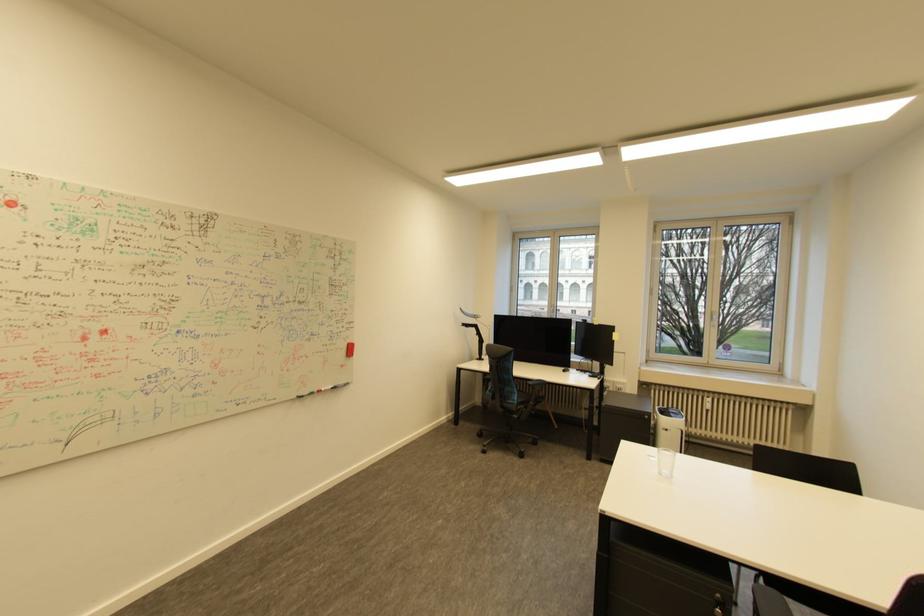
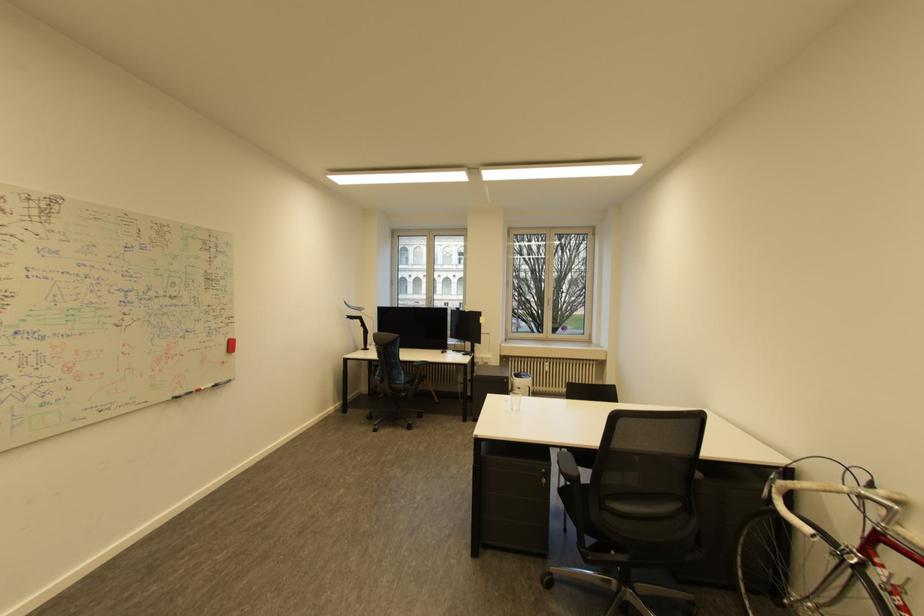
Question: Based on the continuous images, in which direction is the camera rotating? Reply with the corresponding letter.

Choices:
 (A) Left
 (B) Right
 (C) Up
 (D) Down

Answer: (B)